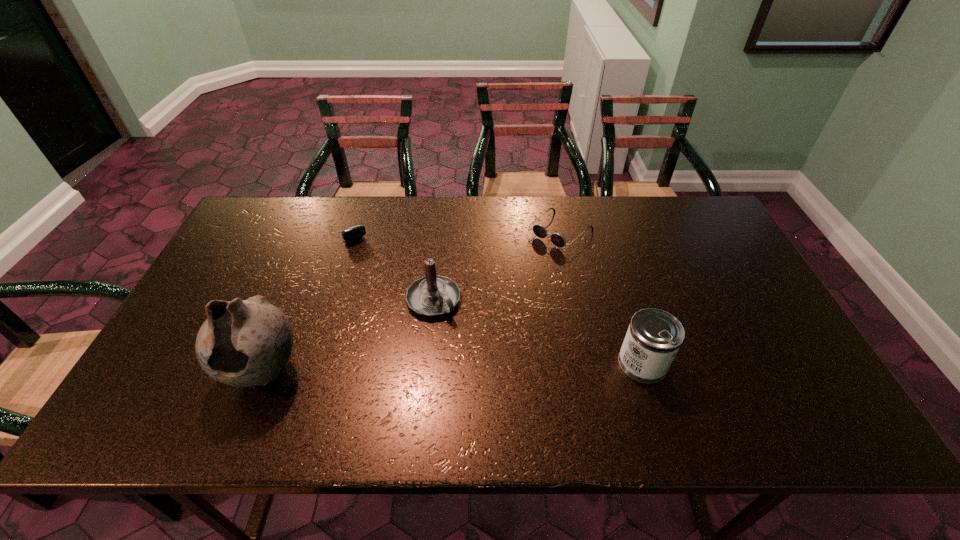
Locate an element on the screen. The height and width of the screenshot is (540, 960). free area in between the sunglasses and the third farthest object is located at coordinates (497, 266).

The width and height of the screenshot is (960, 540). In order to click on unoccupied area between the webcam and the sunglasses in this screenshot , I will do `click(455, 228)`.

Where is `free space that is in between the pottery and the can`? free space that is in between the pottery and the can is located at coordinates (453, 367).

The height and width of the screenshot is (540, 960). Find the location of `free space between the tallest object and the can`. free space between the tallest object and the can is located at coordinates (453, 367).

In order to click on object that is the closest to the can in this screenshot , I will do pos(540,231).

What are the coordinates of `the closest object to the candle` in the screenshot? It's located at (353, 233).

Locate an element on the screen. The image size is (960, 540). free space that satisfies the following two spatial constraints: 1. on the front side of the can; 2. on the left side of the sunglasses is located at coordinates (588, 363).

Locate an element on the screen. vacant position in the image that satisfies the following two spatial constraints: 1. on the back side of the sunglasses; 2. on the left side of the candle is located at coordinates (441, 231).